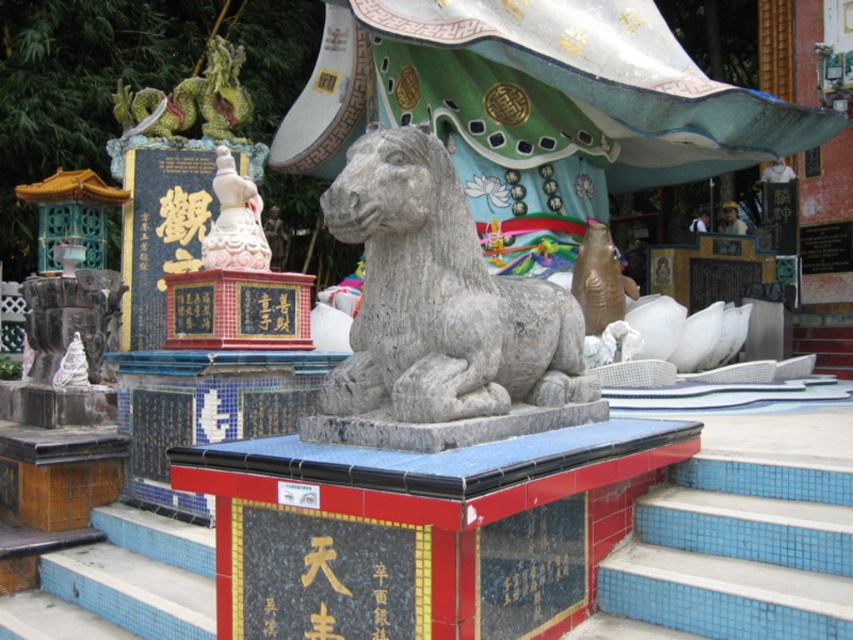
Question: Which is farther from the blue tile stairs at lower left?

Choices:
 (A) gray stone horse at center
 (B) white marble statue at upper left
 (C) white marble statue at left

Answer: (C)

Question: Is blue tile stairs at lower left further to camera compared to white marble statue at left?

Choices:
 (A) yes
 (B) no

Answer: (B)

Question: Estimate the real-world distances between objects in this image. Which object is closer to the white marble statue at upper left?

Choices:
 (A) white marble statue at left
 (B) blue tile stairs at lower left

Answer: (A)

Question: Does gray stone horse at center appear on the left side of white marble statue at left?

Choices:
 (A) no
 (B) yes

Answer: (A)

Question: Which point is closer to the camera?

Choices:
 (A) blue tile stairs at lower left
 (B) gray stone horse at center
 (C) white marble statue at left
 (D) white marble statue at upper left

Answer: (A)

Question: Is gray stone horse at center wider than white marble statue at left?

Choices:
 (A) yes
 (B) no

Answer: (B)